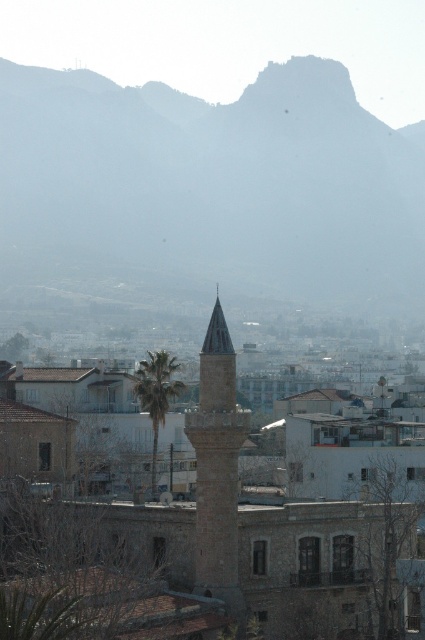
Question: Which object is closer to the camera taking this photo?

Choices:
 (A) smooth stone minaret at center
 (B) gray rocky mountain at upper center

Answer: (A)

Question: Which object is closer to the camera taking this photo?

Choices:
 (A) green leafy palm at center
 (B) gray rocky mountain at upper center
 (C) smooth stone minaret at center

Answer: (C)

Question: Is smooth stone minaret at center positioned in front of green leafy palm at center?

Choices:
 (A) no
 (B) yes

Answer: (B)

Question: Does gray rocky mountain at upper center have a larger size compared to green leafy palm at center?

Choices:
 (A) no
 (B) yes

Answer: (B)

Question: Does gray rocky mountain at upper center have a smaller size compared to green leafy palm at center?

Choices:
 (A) yes
 (B) no

Answer: (B)

Question: Which object appears farthest from the camera in this image?

Choices:
 (A) gray rocky mountain at upper center
 (B) smooth stone minaret at center

Answer: (A)